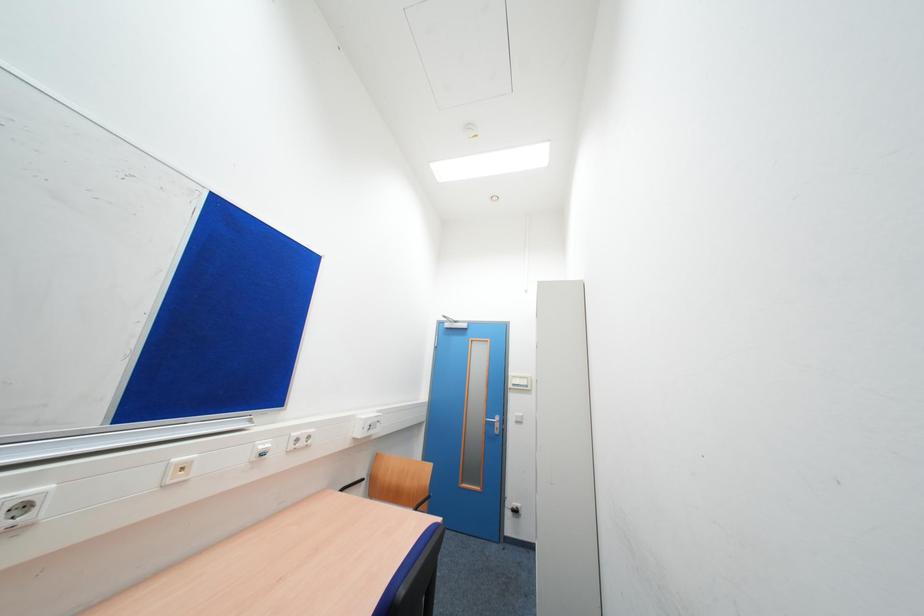
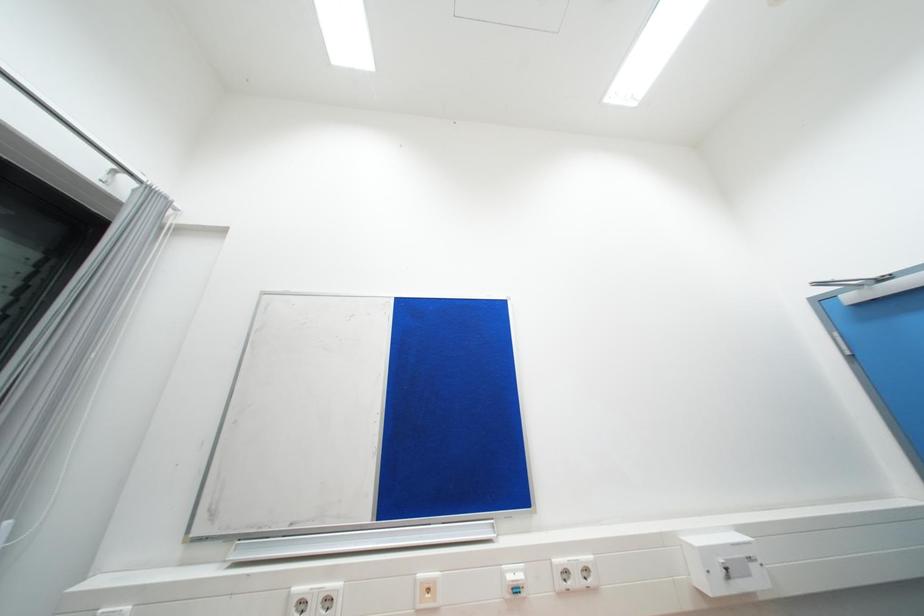
Consider the image. The first image is from the beginning of the video and the second image is from the end. How did the camera likely rotate when shooting the video?

The camera's rotation is toward left-up.